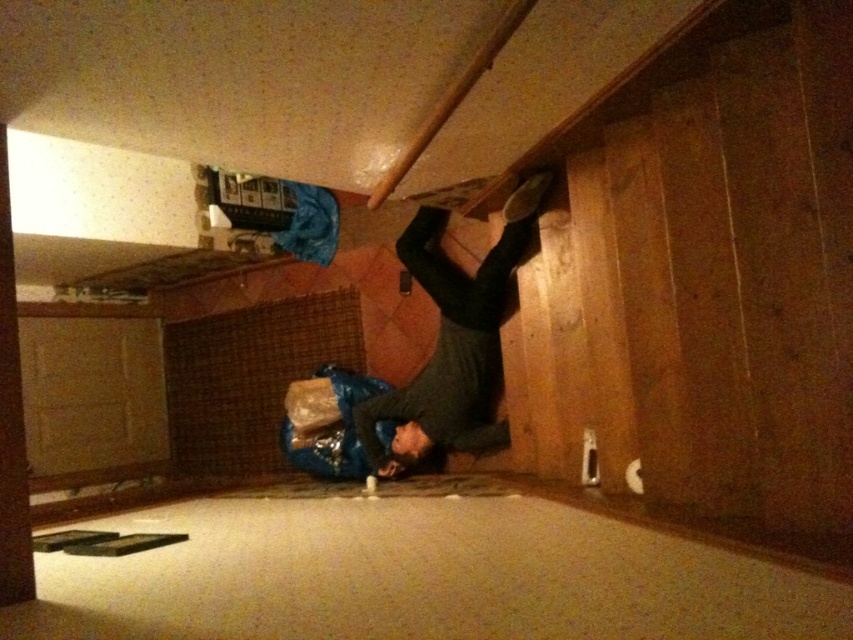
You are trying to determine which item is closer to the camera between the carpet at lower center and the dark gray sweater at center. Based on their positions, which one is closer?

The carpet at lower center is shorter than the dark gray sweater at center, so the dark gray sweater at center is closer to the camera.

You are trying to decide whether to place a small toy on either the dark gray sweater at center or the wooden beam at upper center. Based on their sizes, which surface would be more stable for the toy?

The dark gray sweater at center is larger in size than the wooden beam at upper center, so placing the toy on the dark gray sweater at center would provide a more stable surface due to its larger area.

You are trying to determine the relative heights of objects in the room. Based on the scene, which object is taller between the carpet at lower center and the wooden beam at upper center?

The carpet at lower center is taller than the wooden beam at upper center according to the description.